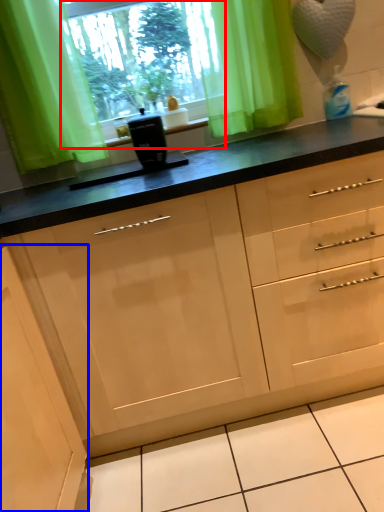
Question: Which object appears farthest to the camera in this image, window screen (highlighted by a red box) or cabinetry (highlighted by a blue box)?

Choices:
 (A) window screen
 (B) cabinetry

Answer: (A)